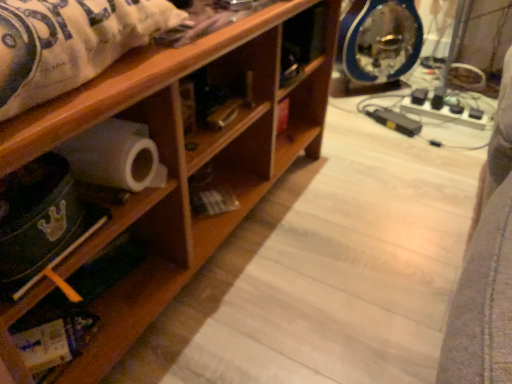
You are a GUI agent. You are given a task and a screenshot of the screen. Output one action in this format:
    pyautogui.click(x=<x>, y=<y>)
    Task: Click on the blue metallic clock at upper right
    This screenshot has width=512, height=384.
    Given the screenshot: What is the action you would take?
    pyautogui.click(x=379, y=40)

What do you see at coordinates (379, 40) in the screenshot? I see `blue metallic clock at upper right` at bounding box center [379, 40].

What is the approximate height of blue metallic clock at upper right?

blue metallic clock at upper right is 16.38 inches tall.

Find the location of `blue metallic clock at upper right`. blue metallic clock at upper right is located at coordinates (379, 40).